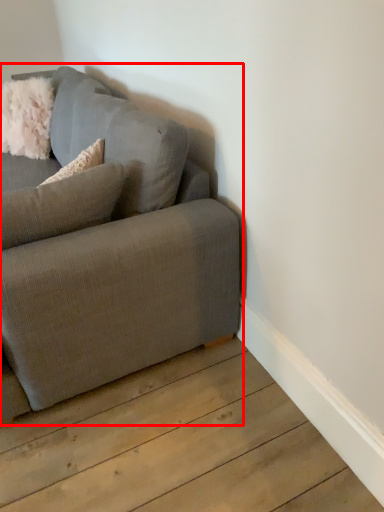
Question: Where is studio couch (annotated by the red box) located in relation to pillow in the image?

Choices:
 (A) left
 (B) right

Answer: (A)